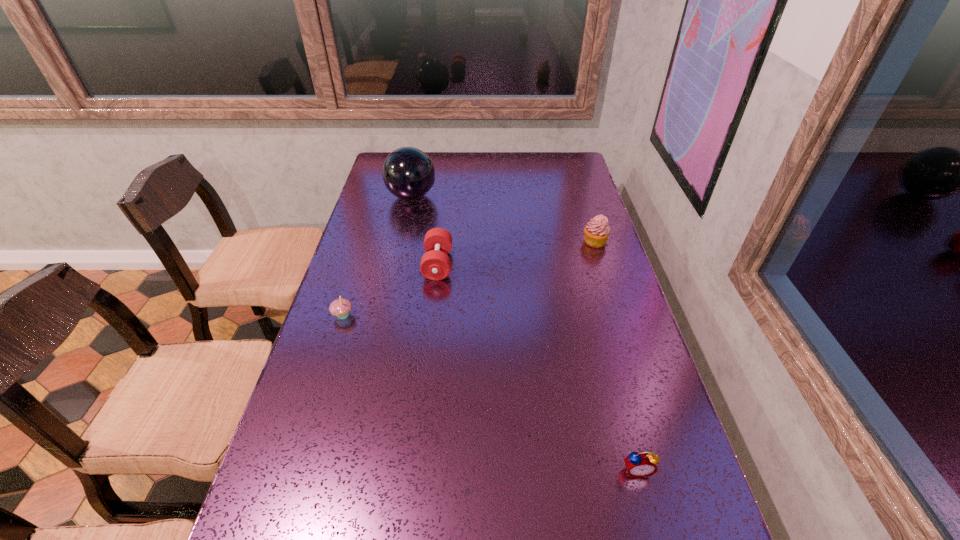
Where is `vacant area that lies between the left cupcake and the bowling ball`? This screenshot has height=540, width=960. vacant area that lies between the left cupcake and the bowling ball is located at coordinates (377, 256).

This screenshot has width=960, height=540. I want to click on the closest object to the tallest object, so click(435, 264).

Identify the location of object that is the fourth closest to the dumbbell. (641, 464).

You are a GUI agent. You are given a task and a screenshot of the screen. Output one action in this format:
    pyautogui.click(x=<x>, y=<y>)
    Task: Click on the free space that satisfies the following two spatial constraints: 1. on the back side of the dumbbell; 2. on the side of the tallest object with the finger holes
    Image resolution: width=960 pixels, height=540 pixels.
    Given the screenshot: What is the action you would take?
    pyautogui.click(x=445, y=196)

In order to click on free location that satisfies the following two spatial constraints: 1. on the side of the farthest object with the finger holes; 2. on the back side of the taller cupcake in this screenshot , I will do `click(401, 241)`.

Identify the location of free region that satisfies the following two spatial constraints: 1. on the back side of the taller cupcake; 2. on the left side of the dumbbell. (441, 241).

The image size is (960, 540). I want to click on free space that satisfies the following two spatial constraints: 1. on the back side of the left cupcake; 2. on the right side of the dumbbell, so click(x=359, y=265).